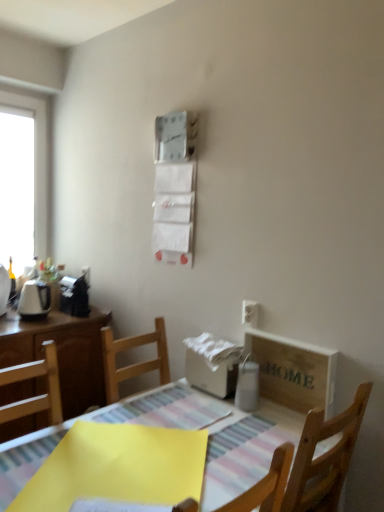
Where is `free space between wooden crate at lower right and yellow paper at lower left`? Image resolution: width=384 pixels, height=512 pixels. free space between wooden crate at lower right and yellow paper at lower left is located at coordinates (217, 433).